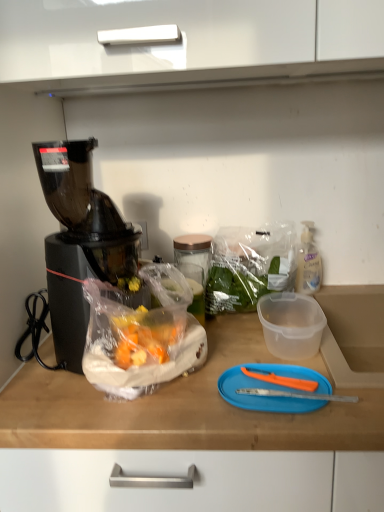
Question: From a real-world perspective, is translucent plastic bag at center over black plastic blender at left?

Choices:
 (A) yes
 (B) no

Answer: (B)

Question: Is translucent plastic bag at center to the left of black plastic blender at left from the viewer's perspective?

Choices:
 (A) no
 (B) yes

Answer: (A)

Question: Is translucent plastic bag at center smaller than black plastic blender at left?

Choices:
 (A) no
 (B) yes

Answer: (B)

Question: Does translucent plastic bag at center have a greater width compared to black plastic blender at left?

Choices:
 (A) yes
 (B) no

Answer: (B)

Question: From a real-world perspective, is translucent plastic bag at center positioned under black plastic blender at left based on gravity?

Choices:
 (A) yes
 (B) no

Answer: (A)

Question: Does translucent plastic bag at center have a lesser width compared to black plastic blender at left?

Choices:
 (A) no
 (B) yes

Answer: (B)

Question: From the image's perspective, does clear plastic bottle at right appear lower than blue plastic cutting board at center?

Choices:
 (A) yes
 (B) no

Answer: (B)

Question: Considering the relative sizes of clear plastic bottle at right and blue plastic cutting board at center in the image provided, is clear plastic bottle at right smaller than blue plastic cutting board at center?

Choices:
 (A) no
 (B) yes

Answer: (A)

Question: Is clear plastic bottle at right far from blue plastic cutting board at center?

Choices:
 (A) no
 (B) yes

Answer: (A)

Question: From the image's perspective, would you say clear plastic bottle at right is positioned over blue plastic cutting board at center?

Choices:
 (A) no
 (B) yes

Answer: (B)

Question: From a real-world perspective, is clear plastic bottle at right physically above blue plastic cutting board at center?

Choices:
 (A) no
 (B) yes

Answer: (B)

Question: Does clear plastic bottle at right turn towards blue plastic cutting board at center?

Choices:
 (A) yes
 (B) no

Answer: (A)

Question: Does black plastic blender at left come in front of clear plastic bottle at right?

Choices:
 (A) no
 (B) yes

Answer: (B)